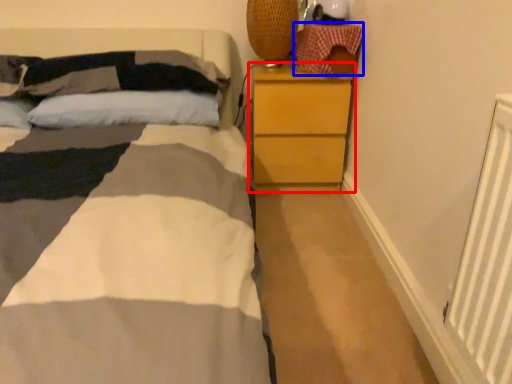
Question: Which of the following is the closest to the observer, chest of drawers (highlighted by a red box) or material (highlighted by a blue box)?

Choices:
 (A) chest of drawers
 (B) material

Answer: (B)